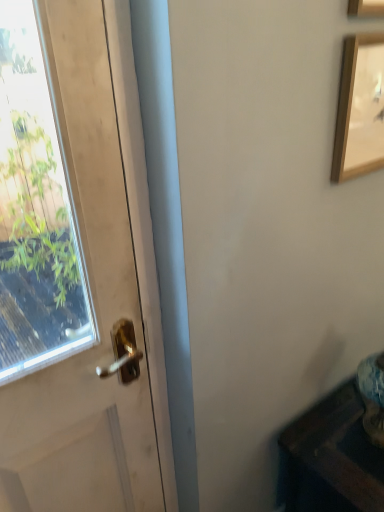
Question: From the image's perspective, is wooden picture frame at upper right, which appears as the first picture frame when ordered from the bottom, located above or below wooden picture frame at upper right, the 2th picture frame positioned from the bottom?

Choices:
 (A) above
 (B) below

Answer: (B)

Question: Based on their sizes in the image, would you say wooden picture frame at upper right, which appears as the first picture frame when ordered from the bottom, is bigger or smaller than wooden picture frame at upper right, the 2th picture frame positioned from the bottom?

Choices:
 (A) small
 (B) big

Answer: (A)

Question: Which object is the closest to the wooden table at lower right?

Choices:
 (A) white matte door at left
 (B) wooden picture frame at upper right, the 2th picture frame positioned from the bottom
 (C) wooden picture frame at upper right, the second picture frame viewed from the top

Answer: (C)

Question: Which of these objects is positioned closest to the white matte door at left?

Choices:
 (A) wooden picture frame at upper right, the second picture frame viewed from the top
 (B) wooden table at lower right
 (C) wooden picture frame at upper right, acting as the first picture frame starting from the top

Answer: (B)